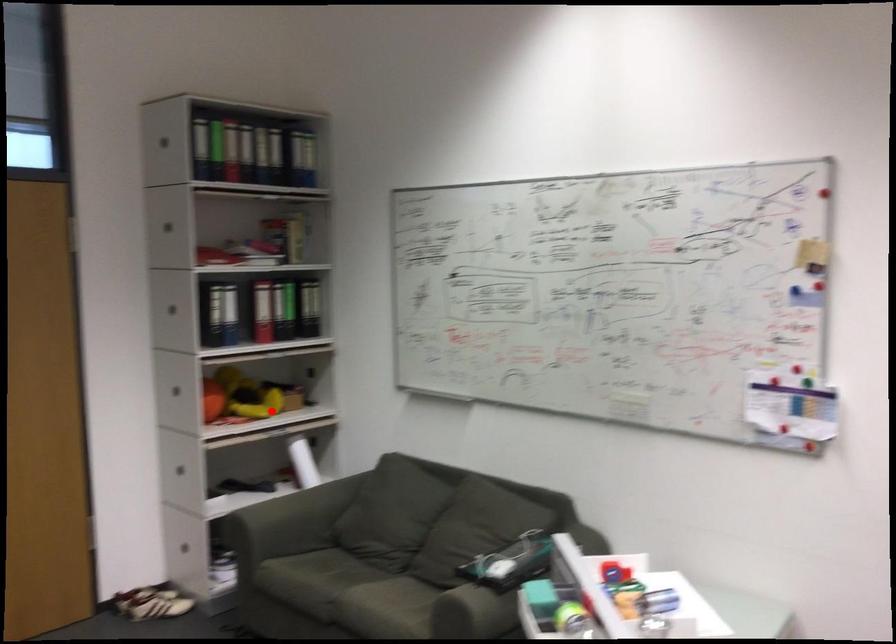
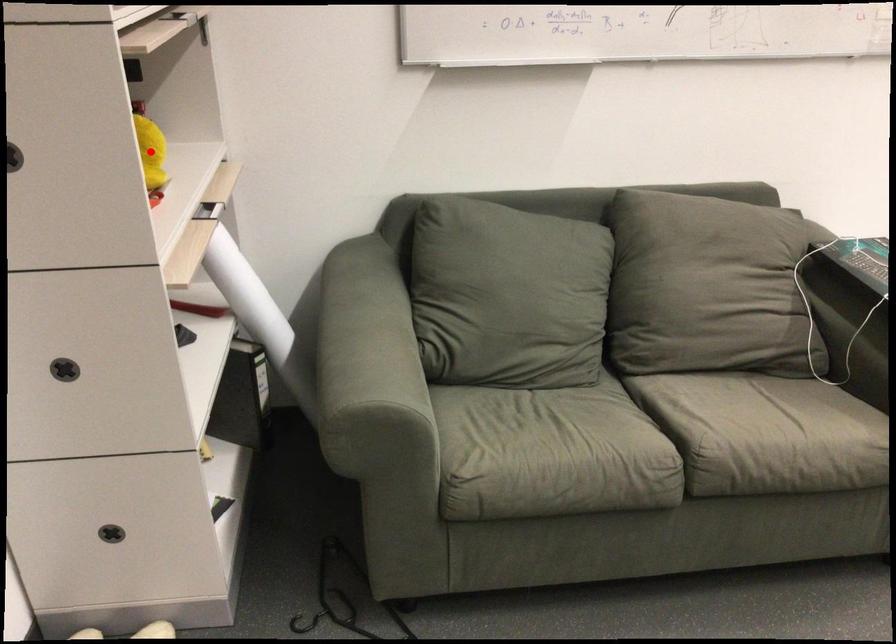
I am providing you with two images of the same scene from different viewpoints. A red point is marked on the first image and another point is marked on the second image. Does the point marked in image1 correspond to the same location as the one in image2?

Yes